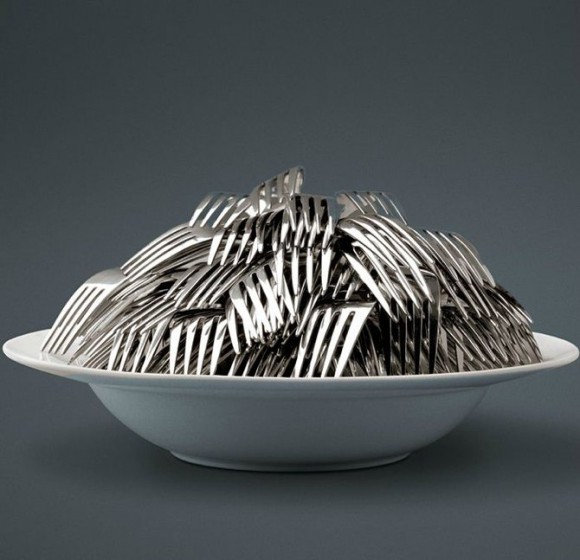
Image resolution: width=580 pixels, height=560 pixels. Identify the location of forks. (297, 290).